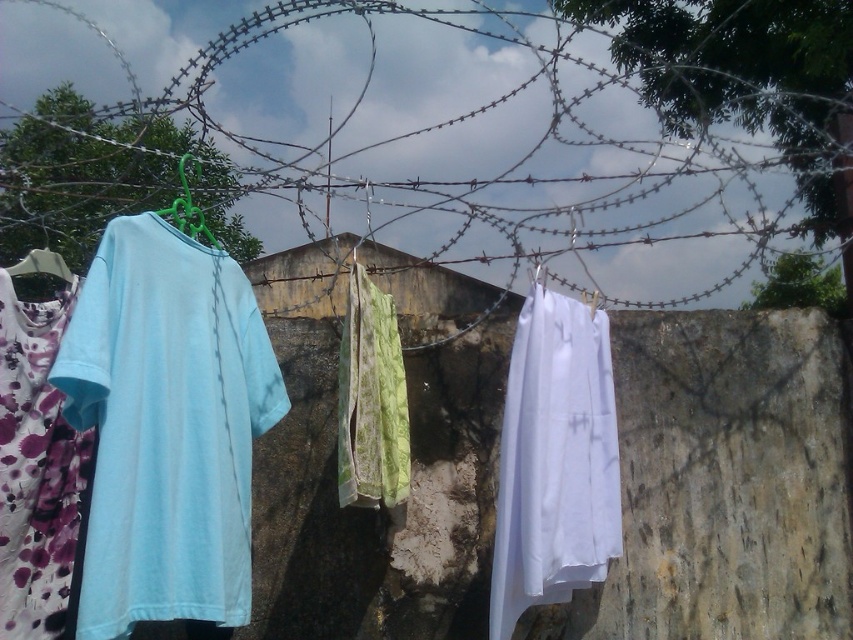
You are a painter standing in front of the clothesline. You want to paint the rusty wire at center and the green plastic hanger at upper left. Which object will appear closer to you in your painting?

The rusty wire at center will appear closer to you in your painting because it is positioned further to the viewer than the green plastic hanger at upper left.